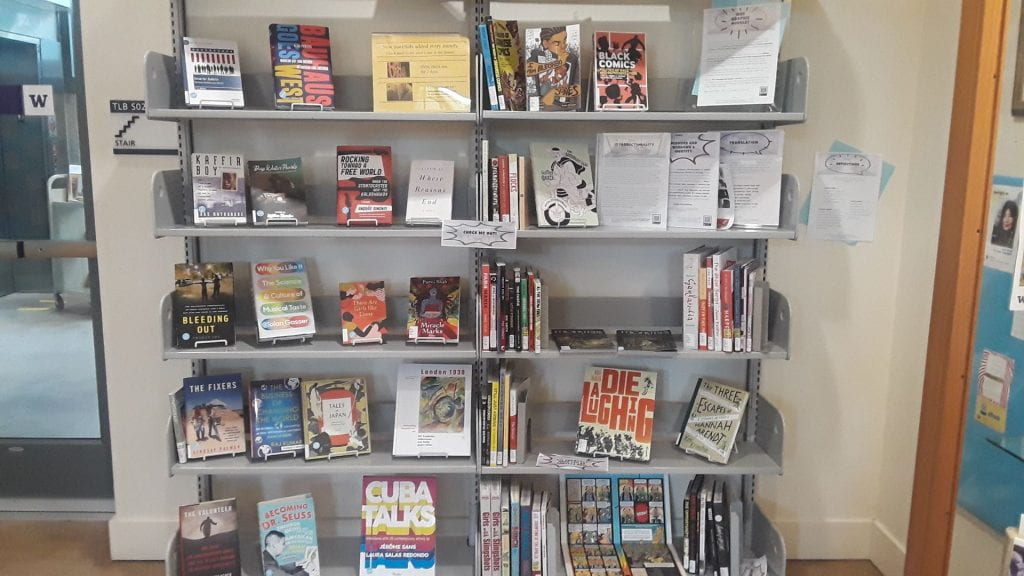
Where is `white paper on wall`? This screenshot has height=576, width=1024. white paper on wall is located at coordinates (850, 200).